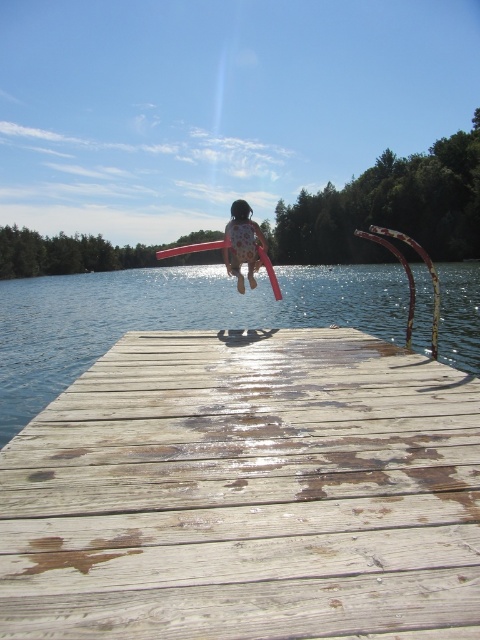
Which is in front, point (399, 564) or point (427, 300)?

Positioned in front is point (399, 564).

Who is positioned more to the right, weathered wood dock at center or clear water at center?

From the viewer's perspective, clear water at center appears more on the right side.

Where is `weathered wood dock at center`? Image resolution: width=480 pixels, height=640 pixels. weathered wood dock at center is located at coordinates (245, 493).

This screenshot has height=640, width=480. In order to click on weathered wood dock at center in this screenshot , I will do `click(245, 493)`.

From the picture: Measure the distance between point (1,531) and camera.

The distance of point (1,531) from camera is 6.18 feet.

Which is in front, point (479, 406) or point (230, 211)?

Point (479, 406)

Identify the location of weathered wood dock at center. The image size is (480, 640). (245, 493).

From the picture: Is clear water at center wider than matte pink swimsuit at center?

Yes, clear water at center is wider than matte pink swimsuit at center.

Which is behind, point (164, 282) or point (249, 237)?

Point (164, 282)

Does point (23, 289) come in front of point (239, 272)?

No, (23, 289) is further to viewer.

Where is `clear water at center`? clear water at center is located at coordinates (169, 316).